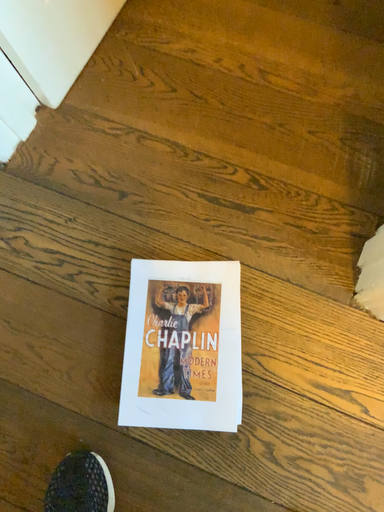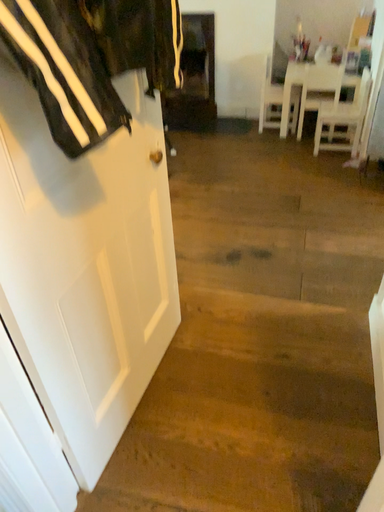
Question: Which way did the camera rotate in the video?

Choices:
 (A) rotated upward
 (B) rotated downward

Answer: (A)